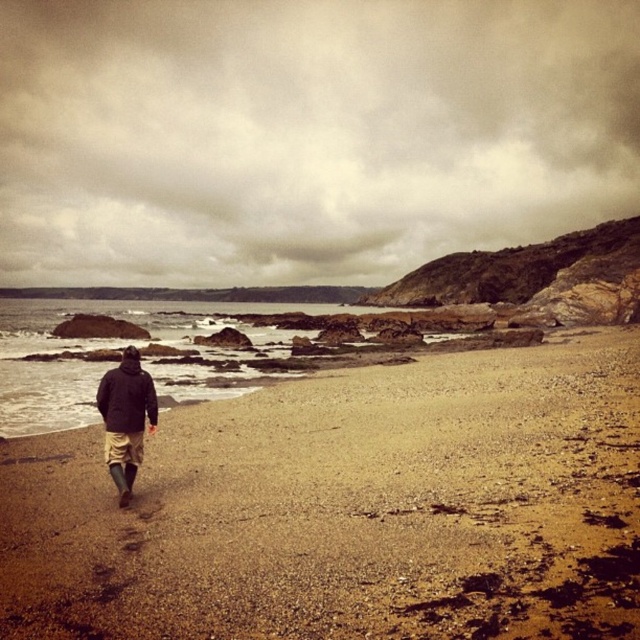
Question: Which point is farther to the camera?

Choices:
 (A) brown gravelly sand at center
 (B) cloudy sky at upper center
 (C) black matte jacket at lower left
 (D) dark brown leather jacket at center

Answer: (B)

Question: Does brown gravelly sand at center have a larger size compared to black matte jacket at lower left?

Choices:
 (A) yes
 (B) no

Answer: (A)

Question: Which object is closer to the camera taking this photo?

Choices:
 (A) black matte jacket at lower left
 (B) dark brown leather jacket at center

Answer: (B)

Question: Is cloudy sky at upper center thinner than black matte jacket at lower left?

Choices:
 (A) no
 (B) yes

Answer: (A)

Question: Which of the following is the closest to the observer?

Choices:
 (A) dark brown leather jacket at center
 (B) brown gravelly sand at center

Answer: (B)

Question: Does cloudy sky at upper center have a lesser width compared to black matte jacket at lower left?

Choices:
 (A) no
 (B) yes

Answer: (A)